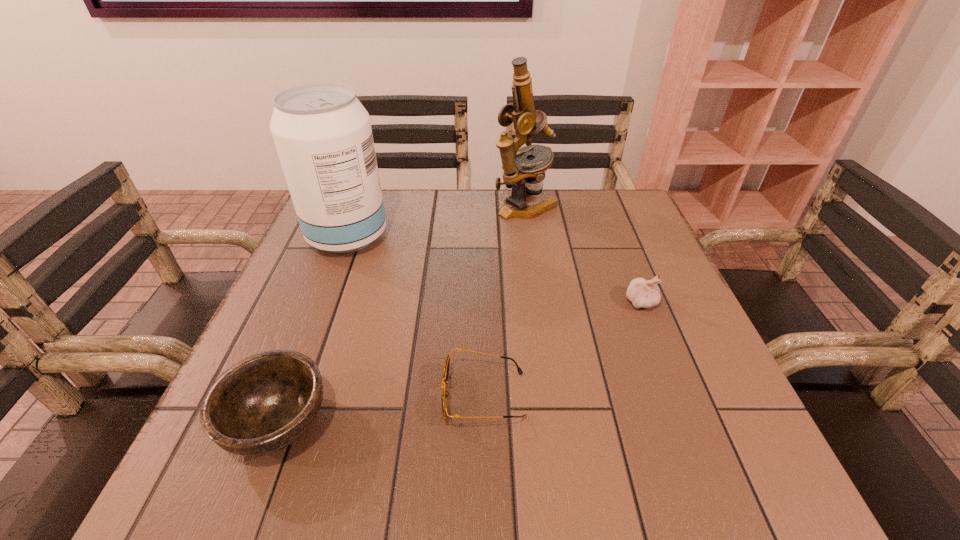
The image size is (960, 540). In order to click on free space located on the lenses of the shortest object in this screenshot , I will do `click(226, 395)`.

This screenshot has height=540, width=960. I want to click on vacant region located on the lenses of the shortest object, so click(354, 395).

Image resolution: width=960 pixels, height=540 pixels. Identify the location of free space located on the lenses of the shortest object. (372, 395).

Locate an element on the screen. Image resolution: width=960 pixels, height=540 pixels. microscope situated at the far edge is located at coordinates (524, 176).

You are a GUI agent. You are given a task and a screenshot of the screen. Output one action in this format:
    pyautogui.click(x=<x>, y=<y>)
    Task: Click on the alcohol present at the far edge
    The image size is (960, 540).
    Given the screenshot: What is the action you would take?
    pyautogui.click(x=322, y=133)

You are a GUI agent. You are given a task and a screenshot of the screen. Output one action in this format:
    pyautogui.click(x=<x>, y=<y>)
    Task: Click on the object that is at the near edge
    The width and height of the screenshot is (960, 540).
    Given the screenshot: What is the action you would take?
    pyautogui.click(x=262, y=404)

Where is `alcohol at the left edge`? The image size is (960, 540). alcohol at the left edge is located at coordinates (322, 133).

Where is `bowl positioned at the left edge`? bowl positioned at the left edge is located at coordinates pos(262,404).

Find the location of `object that is positioned at the right edge`. object that is positioned at the right edge is located at coordinates (643, 294).

Locate an element on the screen. The image size is (960, 540). object positioned at the far left corner is located at coordinates (322, 133).